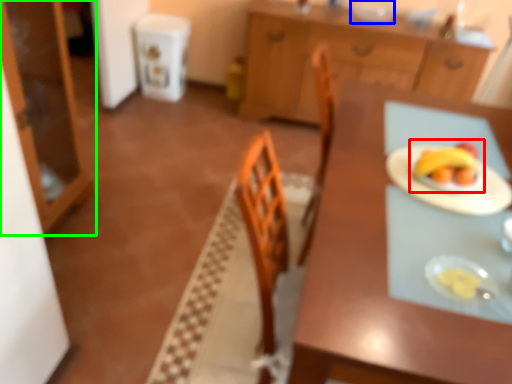
Question: Which object is positioned closest to fruit dish (highlighted by a red box)? Select from tableware (highlighted by a blue box) and cabinetry (highlighted by a green box).

Choices:
 (A) tableware
 (B) cabinetry

Answer: (B)